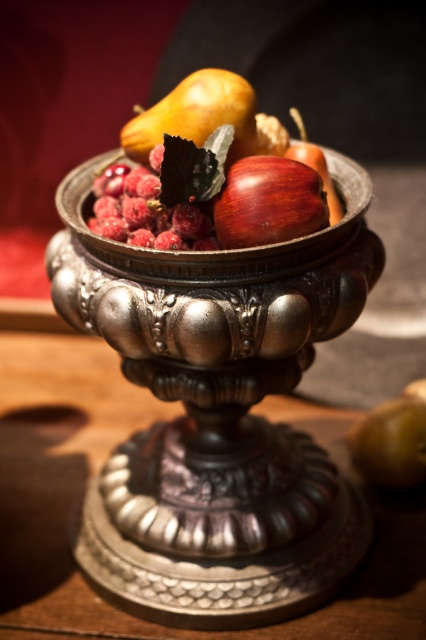
Which of these two, shiny green apple at lower right or shiny red apple at center, stands shorter?

shiny red apple at center is shorter.

Between shiny green apple at lower right and shiny red apple at center, which one appears on the right side from the viewer's perspective?

From the viewer's perspective, shiny green apple at lower right appears more on the right side.

Where is `shiny green apple at lower right`? The height and width of the screenshot is (640, 426). shiny green apple at lower right is located at coordinates (393, 440).

What do you see at coordinates (218, 413) in the screenshot?
I see `metallic silver bowl at center` at bounding box center [218, 413].

Which of these two, metallic silver bowl at center or shiny green apple at lower right, stands shorter?

Standing shorter between the two is shiny green apple at lower right.

I want to click on metallic silver bowl at center, so click(x=218, y=413).

Between metallic silver bowl at center and shiny brown pear at center, which one has less height?

Standing shorter between the two is shiny brown pear at center.

Which is more to the right, metallic silver bowl at center or shiny brown pear at center?

metallic silver bowl at center is more to the right.

Where is `metallic silver bowl at center`? The width and height of the screenshot is (426, 640). metallic silver bowl at center is located at coordinates (218, 413).

The height and width of the screenshot is (640, 426). What are the coordinates of `metallic silver bowl at center` in the screenshot? It's located at (218, 413).